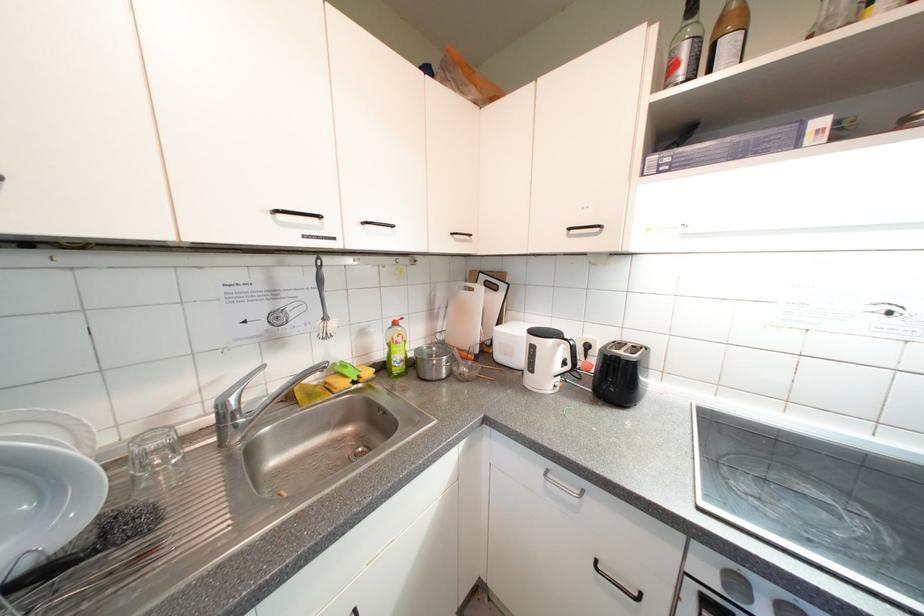
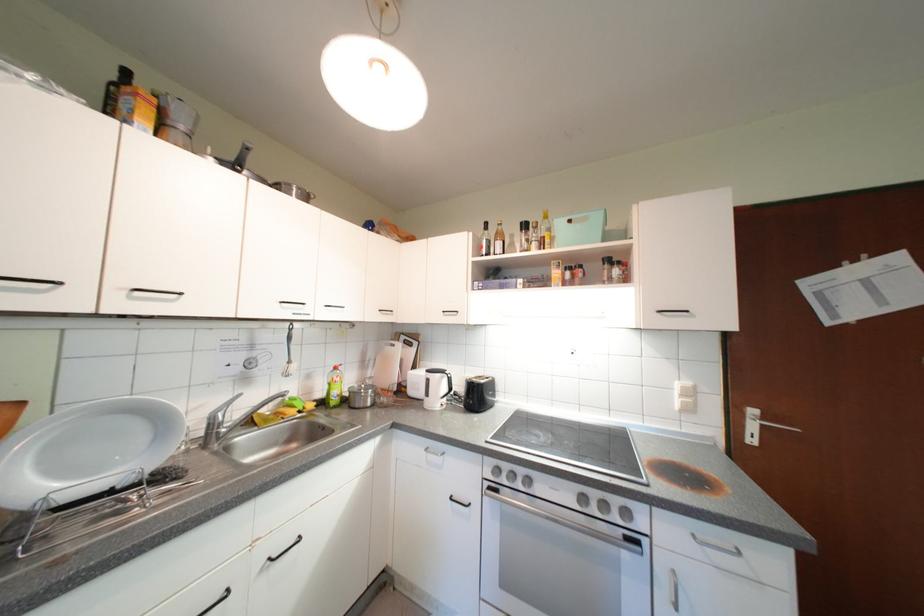
Find the pixel in the second image that matches (x=286, y=217) in the first image.

(292, 306)